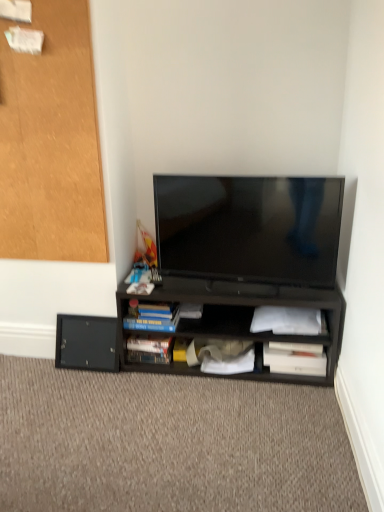
Question: Is white matte paper at lower right, which is counted as the third paperback book, starting from the left, looking in the opposite direction of black matte shelf at center?

Choices:
 (A) no
 (B) yes

Answer: (B)

Question: Considering the relative sizes of white matte paper at lower right, the 2th paperback book positioned from the right, and black matte shelf at center in the image provided, is white matte paper at lower right, the 2th paperback book positioned from the right, thinner than black matte shelf at center?

Choices:
 (A) yes
 (B) no

Answer: (A)

Question: From a real-world perspective, is white matte paper at lower right, which is counted as the third paperback book, starting from the left, on top of black matte shelf at center?

Choices:
 (A) yes
 (B) no

Answer: (A)

Question: Does white matte paper at lower right, which is counted as the third paperback book, starting from the left, have a greater height compared to black matte shelf at center?

Choices:
 (A) yes
 (B) no

Answer: (B)

Question: Does white matte paper at lower right, the 2th paperback book positioned from the right, appear on the left side of black matte shelf at center?

Choices:
 (A) yes
 (B) no

Answer: (B)

Question: Is white matte paper at lower right, which is counted as the third paperback book, starting from the left, located outside black matte shelf at center?

Choices:
 (A) no
 (B) yes

Answer: (A)

Question: Are matte black tv at center and white paper at lower center beside each other?

Choices:
 (A) no
 (B) yes

Answer: (A)

Question: From a real-world perspective, is matte black tv at center on white paper at lower center?

Choices:
 (A) yes
 (B) no

Answer: (A)

Question: Considering the relative sizes of matte black tv at center and white paper at lower center in the image provided, is matte black tv at center thinner than white paper at lower center?

Choices:
 (A) yes
 (B) no

Answer: (B)

Question: Does matte black tv at center come in front of white paper at lower center?

Choices:
 (A) no
 (B) yes

Answer: (B)

Question: From the image's perspective, is matte black tv at center on white paper at lower center?

Choices:
 (A) no
 (B) yes

Answer: (B)

Question: Does matte black tv at center have a greater height compared to white paper at lower center?

Choices:
 (A) yes
 (B) no

Answer: (A)

Question: Could you tell me if black matte drawer at lower left is turned towards carpet at lower center?

Choices:
 (A) yes
 (B) no

Answer: (A)